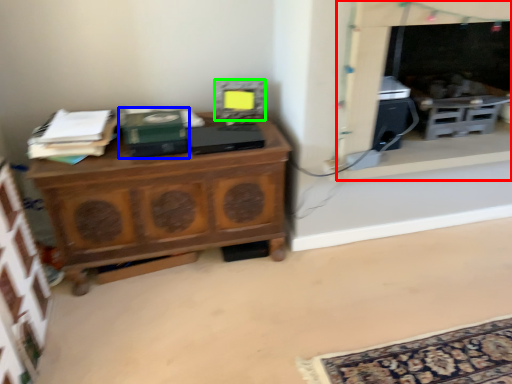
Question: Which is farther away from fireplace (highlighted by a red box)? book (highlighted by a blue box) or appliance (highlighted by a green box)?

Choices:
 (A) book
 (B) appliance

Answer: (A)